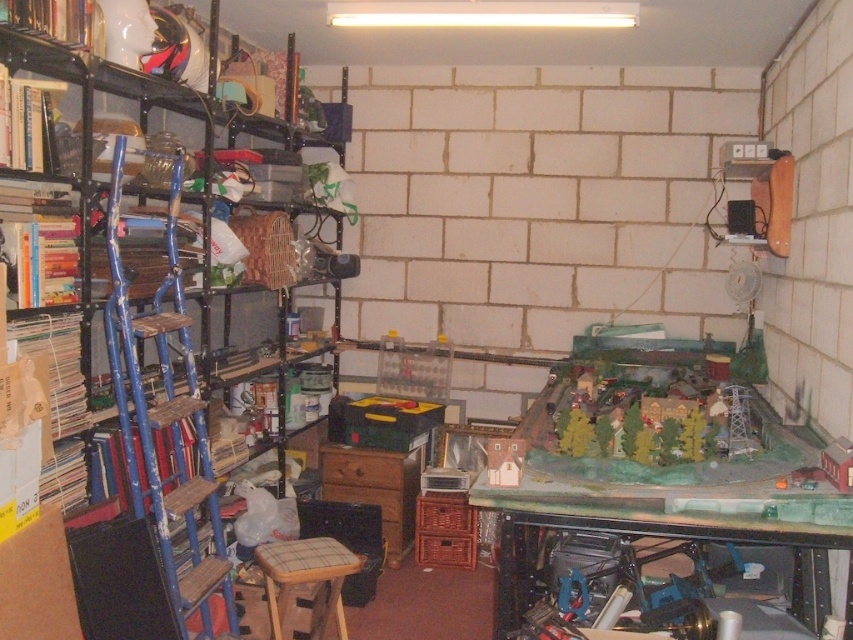
Question: Which point is farther to the camera?

Choices:
 (A) (143, 435)
 (B) (338, 609)
 (C) (526, 561)

Answer: (C)

Question: Which point is farther to the camera?

Choices:
 (A) green matte table at center
 (B) metallic blue ladder at left

Answer: (A)

Question: Among these points, which one is nearest to the camera?

Choices:
 (A) (126, 467)
 (B) (305, 576)

Answer: (B)

Question: Can you confirm if green matte table at center is positioned below wooden stool at center?

Choices:
 (A) yes
 (B) no

Answer: (B)

Question: Can you confirm if metallic blue ladder at left is thinner than wooden stool at center?

Choices:
 (A) no
 (B) yes

Answer: (A)

Question: Is metallic blue ladder at left below wooden stool at center?

Choices:
 (A) yes
 (B) no

Answer: (B)